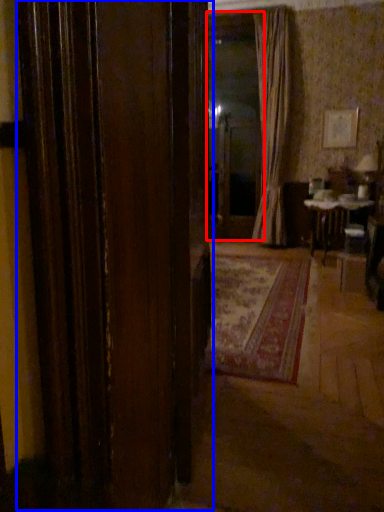
Question: Among these objects, which one is farthest to the camera, window screen (highlighted by a red box) or door (highlighted by a blue box)?

Choices:
 (A) window screen
 (B) door

Answer: (A)